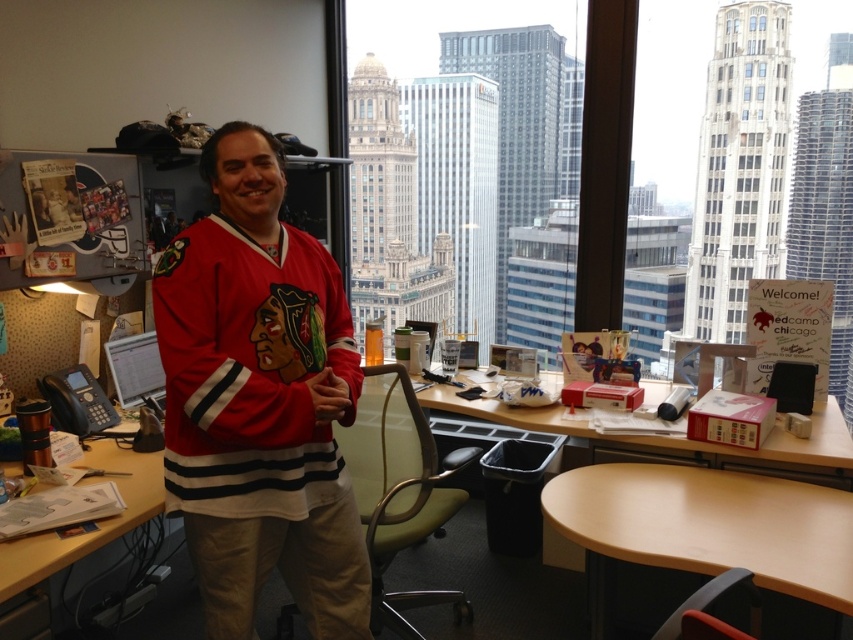
Consider the image. Does light brown wood table at lower right have a larger size compared to wooden desk at lower left?

Yes, light brown wood table at lower right is bigger than wooden desk at lower left.

Which is below, light brown wood table at lower right or wooden desk at lower left?

Positioned lower is light brown wood table at lower right.

Describe the element at coordinates (704, 529) in the screenshot. I see `light brown wood table at lower right` at that location.

At what (x,y) coordinates should I click in order to perform the action: click on light brown wood table at lower right. Please return your answer as a coordinate pair (x, y). This screenshot has height=640, width=853. Looking at the image, I should click on (704, 529).

Which is above, matte jersey at center or light brown wood table at lower right?

Positioned higher is matte jersey at center.

Does matte jersey at center appear under light brown wood table at lower right?

Actually, matte jersey at center is above light brown wood table at lower right.

Which is in front, point (190, 394) or point (778, 548)?

Point (190, 394) is in front.

Identify the location of matte jersey at center. (259, 401).

Between light brown wood table at lower right and wooden desk at center, which one appears on the left side from the viewer's perspective?

wooden desk at center

Between point (613, 508) and point (500, 403), which one is positioned behind?

The point (500, 403) is more distant.

Image resolution: width=853 pixels, height=640 pixels. Identify the location of light brown wood table at lower right. (704, 529).